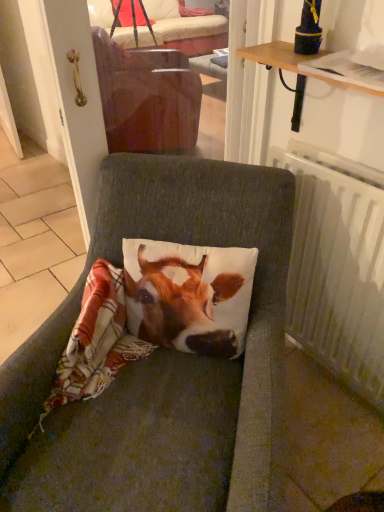
Describe the element at coordinates (337, 265) in the screenshot. The height and width of the screenshot is (512, 384). I see `white plastic radiator at right` at that location.

Where is `white plastic radiator at right`? The width and height of the screenshot is (384, 512). white plastic radiator at right is located at coordinates (337, 265).

The width and height of the screenshot is (384, 512). What are the coordinates of `textured gray cushion at center` in the screenshot? It's located at (161, 362).

The image size is (384, 512). What do you see at coordinates (161, 362) in the screenshot?
I see `textured gray cushion at center` at bounding box center [161, 362].

Identify the location of white plastic radiator at right. (337, 265).

Does textured gray cushion at center appear on the right side of white plastic radiator at right?

No, textured gray cushion at center is not to the right of white plastic radiator at right.

Who is more distant, textured gray cushion at center or white plastic radiator at right?

white plastic radiator at right is behind.

Considering the positions of points (92, 477) and (357, 188), is point (92, 477) closer to camera compared to point (357, 188)?

Yes, it is.

From the image's perspective, is textured gray cushion at center on white plastic radiator at right?

No, from the image's perspective, textured gray cushion at center is not on top of white plastic radiator at right.

From a real-world perspective, is textured gray cushion at center above or below white plastic radiator at right?

textured gray cushion at center is situated lower than white plastic radiator at right in the real world.

Looking at their sizes, would you say textured gray cushion at center is wider or thinner than white plastic radiator at right?

In the image, textured gray cushion at center appears to be wider than white plastic radiator at right.

Does textured gray cushion at center have a lesser height compared to white plastic radiator at right?

Incorrect, the height of textured gray cushion at center does not fall short of that of white plastic radiator at right.

Consider the image. Considering the sizes of objects textured gray cushion at center and white plastic radiator at right in the image provided, who is bigger, textured gray cushion at center or white plastic radiator at right?

textured gray cushion at center.

Would you say textured gray cushion at center is inside or outside white plastic radiator at right?

textured gray cushion at center is located beyond the bounds of white plastic radiator at right.

Are textured gray cushion at center and white plastic radiator at right far apart?

No.

Is textured gray cushion at center oriented towards white plastic radiator at right?

No, textured gray cushion at center does not turn towards white plastic radiator at right.

From the picture: How many degrees apart are the facing directions of textured gray cushion at center and white plastic radiator at right?

textured gray cushion at center and white plastic radiator at right are facing 37.1 degrees away from each other.

Where is `chair in front of the white plastic radiator at right`? chair in front of the white plastic radiator at right is located at coordinates (161, 362).

Is white plastic radiator at right at the left side of textured gray cushion at center?

No, white plastic radiator at right is not to the left of textured gray cushion at center.

Which is behind, white plastic radiator at right or textured gray cushion at center?

white plastic radiator at right is behind.

Is point (294, 316) closer to viewer compared to point (111, 490)?

No, (294, 316) is further to viewer.

From the image's perspective, is white plastic radiator at right located beneath textured gray cushion at center?

Incorrect, from the image's perspective, white plastic radiator at right is higher than textured gray cushion at center.

From a real-world perspective, which object stands above the other?

white plastic radiator at right, from a real-world perspective.

Considering the sizes of white plastic radiator at right and textured gray cushion at center in the image, is white plastic radiator at right wider or thinner than textured gray cushion at center?

Clearly, white plastic radiator at right has less width compared to textured gray cushion at center.

Is white plastic radiator at right taller or shorter than textured gray cushion at center?

In the image, white plastic radiator at right appears to be shorter than textured gray cushion at center.

Between white plastic radiator at right and textured gray cushion at center, which one has smaller size?

With smaller size is white plastic radiator at right.

Would you say textured gray cushion at center is part of white plastic radiator at right's contents?

Actually, textured gray cushion at center is outside white plastic radiator at right.

Is white plastic radiator at right placed right next to textured gray cushion at center?

No, white plastic radiator at right is not in contact with textured gray cushion at center.

Is white plastic radiator at right looking in the opposite direction of textured gray cushion at center?

No.

Where is `chair below the white plastic radiator at right (from the image's perspective)`? This screenshot has height=512, width=384. chair below the white plastic radiator at right (from the image's perspective) is located at coordinates (161, 362).

Where is `radiator positioned vertically above the textured gray cushion at center (from a real-world perspective)`? This screenshot has height=512, width=384. radiator positioned vertically above the textured gray cushion at center (from a real-world perspective) is located at coordinates (337, 265).

This screenshot has width=384, height=512. Identify the location of chair on the left of white plastic radiator at right. (161, 362).